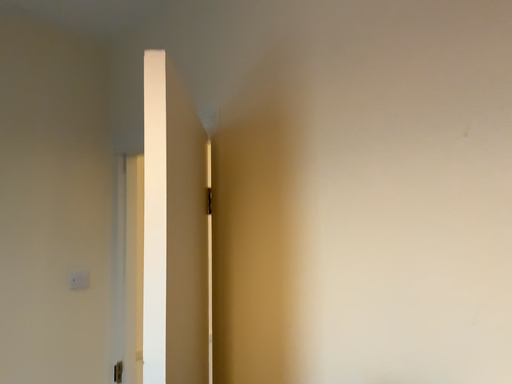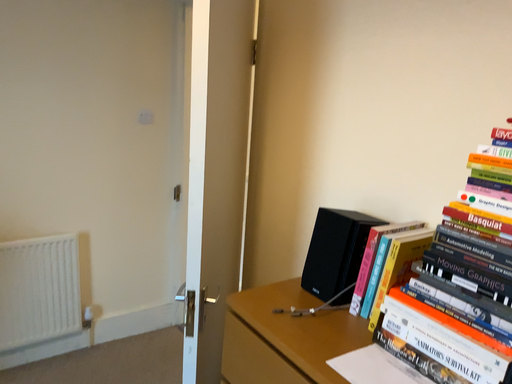
Question: Which way did the camera rotate in the video?

Choices:
 (A) rotated downward
 (B) rotated upward

Answer: (A)